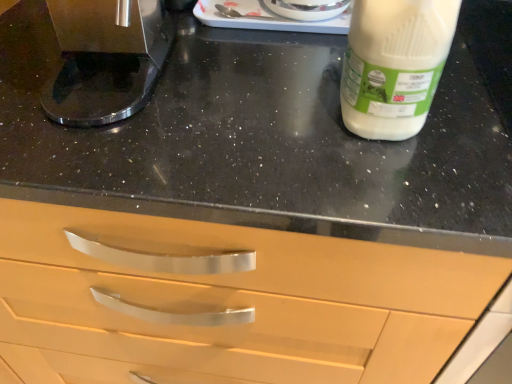
This screenshot has height=384, width=512. What are the coordinates of `blank area to the left of white plastic bottle at upper right` in the screenshot? It's located at (253, 114).